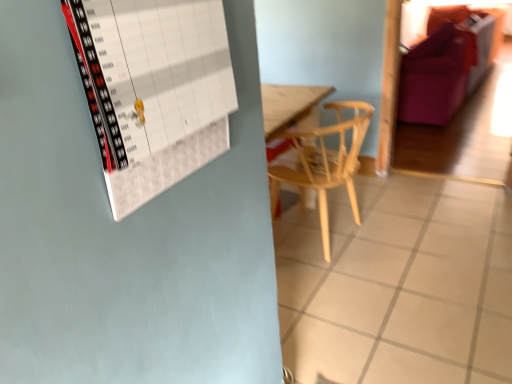
Question: Considering the relative positions of purple fabric couch at upper right and white paper calendar at upper left in the image provided, is purple fabric couch at upper right behind white paper calendar at upper left?

Choices:
 (A) no
 (B) yes

Answer: (B)

Question: Is purple fabric couch at upper right outside white paper calendar at upper left?

Choices:
 (A) no
 (B) yes

Answer: (B)

Question: Is purple fabric couch at upper right shorter than white paper calendar at upper left?

Choices:
 (A) no
 (B) yes

Answer: (A)

Question: From the image's perspective, is purple fabric couch at upper right on top of white paper calendar at upper left?

Choices:
 (A) yes
 (B) no

Answer: (A)

Question: Considering the relative sizes of purple fabric couch at upper right and white paper calendar at upper left in the image provided, is purple fabric couch at upper right smaller than white paper calendar at upper left?

Choices:
 (A) yes
 (B) no

Answer: (B)

Question: Based on their positions, is white tile at center located to the left or right of purple fabric couch at upper right?

Choices:
 (A) left
 (B) right

Answer: (A)

Question: From the image's perspective, is white tile at center located above or below purple fabric couch at upper right?

Choices:
 (A) below
 (B) above

Answer: (A)

Question: Is point (430, 187) positioned closer to the camera than point (436, 77)?

Choices:
 (A) closer
 (B) farther

Answer: (A)

Question: Is white tile at center spatially inside purple fabric couch at upper right, or outside of it?

Choices:
 (A) outside
 (B) inside

Answer: (A)

Question: Relative to light wood chair at center, is white paper calendar at upper left in front or behind?

Choices:
 (A) front
 (B) behind

Answer: (A)

Question: Considering the positions of white paper calendar at upper left and light wood chair at center in the image, is white paper calendar at upper left taller or shorter than light wood chair at center?

Choices:
 (A) tall
 (B) short

Answer: (B)

Question: In the image, is white paper calendar at upper left on the left side or the right side of light wood chair at center?

Choices:
 (A) right
 (B) left

Answer: (B)

Question: Is point (123, 77) positioned closer to the camera than point (360, 135)?

Choices:
 (A) closer
 (B) farther

Answer: (A)

Question: From the image's perspective, is light wood chair at center above or below white tile at center?

Choices:
 (A) above
 (B) below

Answer: (A)

Question: Is light wood chair at center to the left or to the right of white tile at center in the image?

Choices:
 (A) right
 (B) left

Answer: (B)